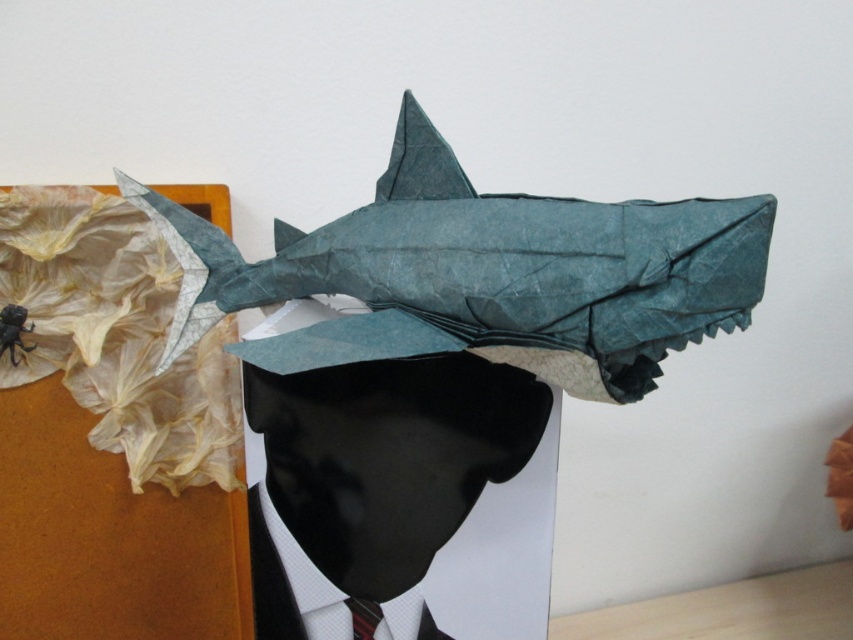
You are an interior designer arranging items on a shelf. You have the matte paper man at center and the red striped tie at center. If you want to place both items side by side without overlapping, which item should you place first to ensure there is enough space?

The matte paper man at center might be wider than the red striped tie at center, so you should place the matte paper man at center first to ensure there is enough space.

You are an interior designer arranging a modern art exhibit. You have a matte paper man at center and a red striped tie at center in your collection. Which object should you place closer to the visitors to ensure they can see both items clearly?

The matte paper man at center should be placed closer to the visitors since it is in front of the red striped tie at center, allowing both items to be viewed clearly without obstruction.

You are an art curator planning to display the origami shark and the mannequin head in a new exhibition. The shark must be placed on a platform that is exactly 1 meter tall. Given that the mannequin head is currently positioned at point (401,499), which represents its center coordinates, can you determine if the platform will be tall enough to ensure the shark remains visible above the mannequin head?

The point (401,499) indicates the matte paper man at center, so the platform must be at least 1 meter tall to ensure the shark remains visible above the mannequin head.